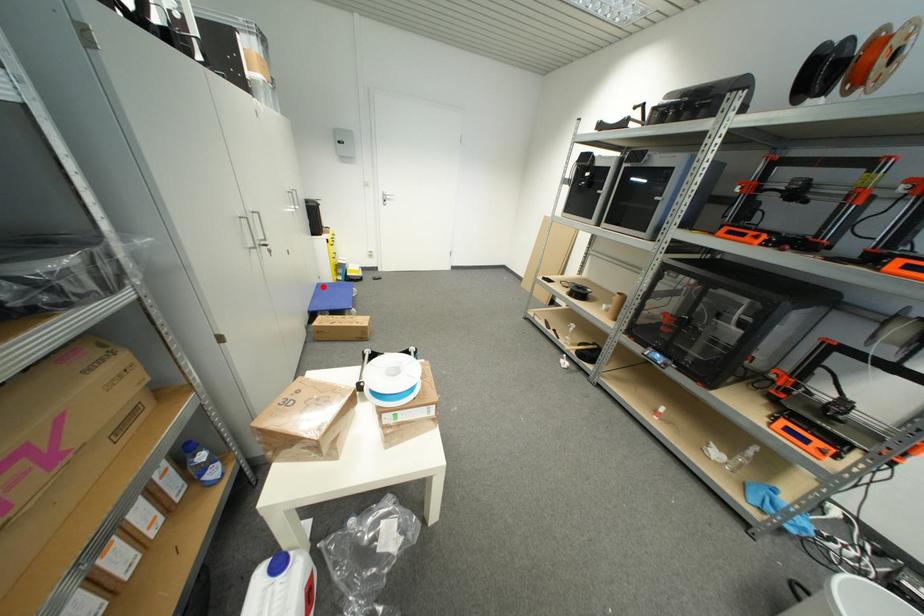
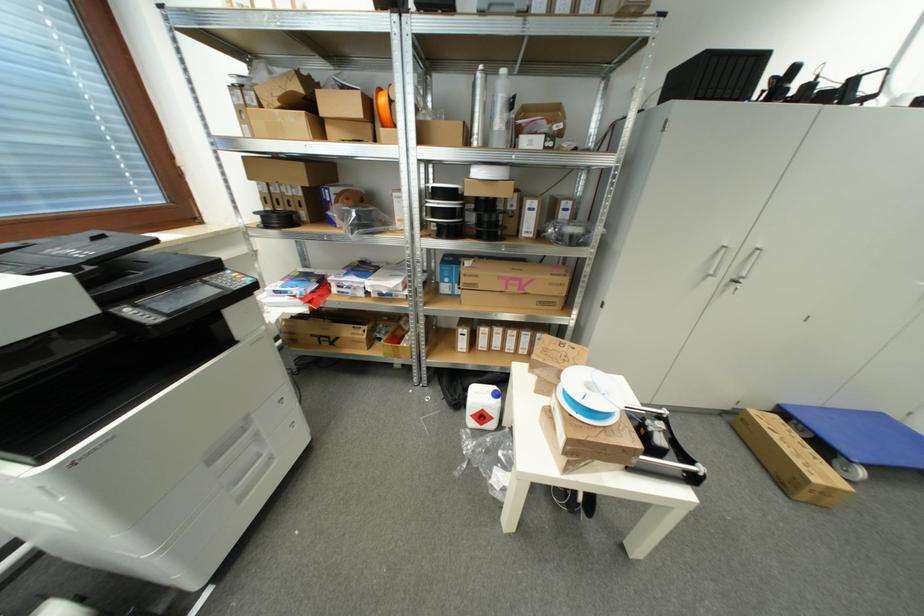
Find the pixel in the second image that matches the highlighted location in the first image.

(885, 418)